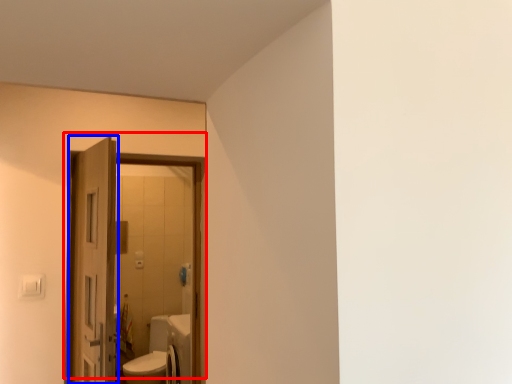
Question: Which object appears closest to the camera in this image, door (highlighted by a red box) or door (highlighted by a blue box)?

Choices:
 (A) door
 (B) door

Answer: (A)